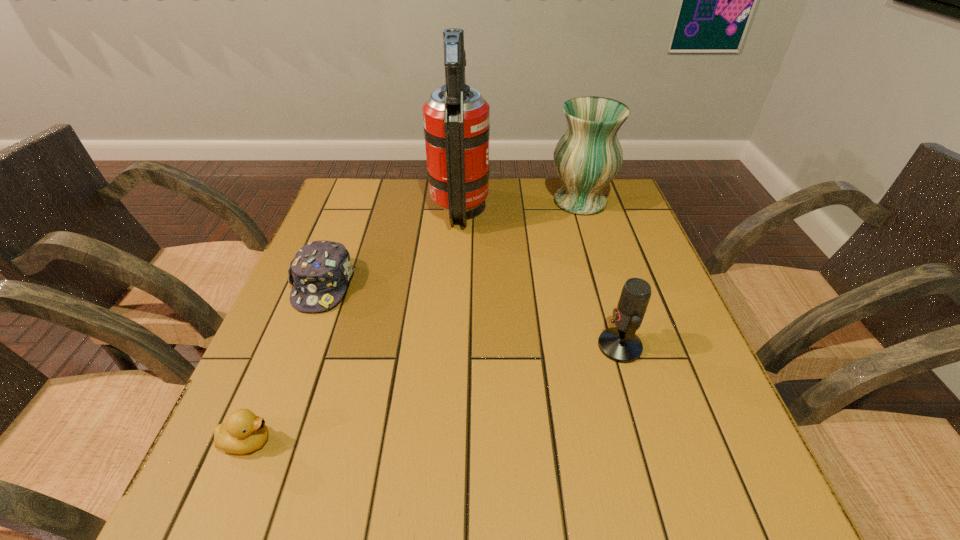
Locate an element on the screen. unoccupied position between the third object from right to left and the microphone is located at coordinates (540, 278).

I want to click on empty location between the fourth shortest object and the duckling, so click(414, 321).

At what (x,y) coordinates should I click in order to perform the action: click on free area in between the nearest object and the fourth farthest object. Please return your answer as a coordinate pair (x, y). Looking at the image, I should click on [x=434, y=394].

You are a GUI agent. You are given a task and a screenshot of the screen. Output one action in this format:
    pyautogui.click(x=<x>, y=<y>)
    Task: Click on the empty space between the second nearest object and the headwear
    
    Given the screenshot: What is the action you would take?
    pyautogui.click(x=471, y=315)

Image resolution: width=960 pixels, height=540 pixels. I want to click on vacant space that is in between the fourth shortest object and the duckling, so click(x=414, y=321).

Identify the location of unoccupied position between the nearest object and the second tallest object. coord(414,321).

Where is `object that stands as the second closest to the headwear`? The image size is (960, 540). object that stands as the second closest to the headwear is located at coordinates click(244, 432).

The image size is (960, 540). Identify the location of object identified as the fourth closest to the vase. (244, 432).

Where is `free space that satisfies the following two spatial constraints: 1. on the front label side of the third object from right to left; 2. on the front-facing side of the headwear`? Image resolution: width=960 pixels, height=540 pixels. free space that satisfies the following two spatial constraints: 1. on the front label side of the third object from right to left; 2. on the front-facing side of the headwear is located at coordinates (455, 285).

Locate an element on the screen. vacant space that satisfies the following two spatial constraints: 1. on the front side of the vase; 2. on the face of the duckling is located at coordinates (655, 441).